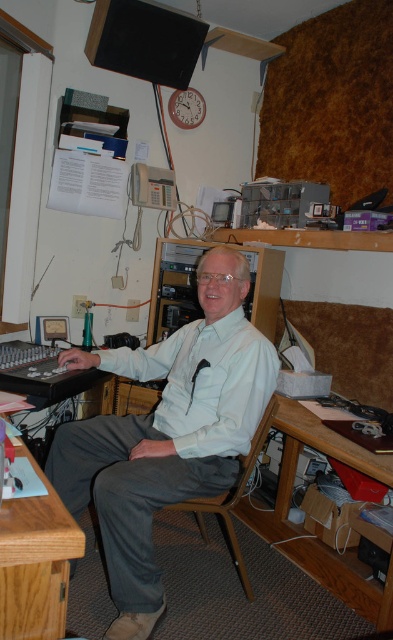
Is white matte shirt at center above wooden chair at center?

Yes, white matte shirt at center is above wooden chair at center.

Which is more to the left, white matte shirt at center or wooden chair at center?

white matte shirt at center is more to the left.

This screenshot has height=640, width=393. What do you see at coordinates (167, 433) in the screenshot?
I see `white matte shirt at center` at bounding box center [167, 433].

The width and height of the screenshot is (393, 640). Find the location of `white matte shirt at center`. white matte shirt at center is located at coordinates (167, 433).

Which is below, brown wood table at lower left or wooden chair at center?

wooden chair at center is below.

Between brown wood table at lower left and wooden chair at center, which one appears on the left side from the viewer's perspective?

brown wood table at lower left is more to the left.

I want to click on brown wood table at lower left, so click(x=36, y=563).

Image resolution: width=393 pixels, height=640 pixels. Find the location of `brown wood table at lower left`. brown wood table at lower left is located at coordinates (36, 563).

From the picture: Does white matte shirt at center appear under brown wood table at lower left?

Incorrect, white matte shirt at center is not positioned below brown wood table at lower left.

Does point (275, 371) lie behind point (34, 637)?

Yes, point (275, 371) is farther from viewer.

Find the location of `white matte shirt at center`. white matte shirt at center is located at coordinates (167, 433).